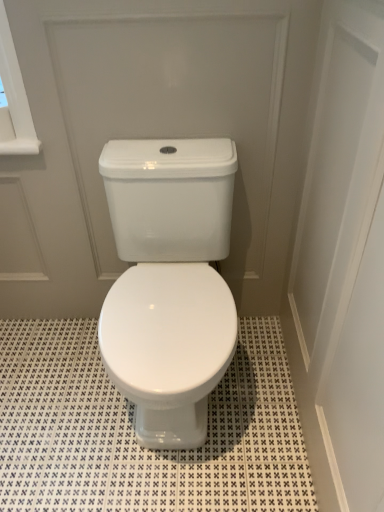
Question: Does white glossy tile at center appear on the right side of white glossy toilet at center, the 2th screen door when ordered from right to left?

Choices:
 (A) yes
 (B) no

Answer: (B)

Question: Is the position of white glossy tile at center less distant than that of white glossy toilet at center, acting as the 1th screen door starting from the left?

Choices:
 (A) yes
 (B) no

Answer: (B)

Question: Is white glossy tile at center aimed at white glossy toilet at center, acting as the 1th screen door starting from the left?

Choices:
 (A) no
 (B) yes

Answer: (A)

Question: Would you consider white glossy tile at center to be distant from white glossy toilet at center, the 2th screen door when ordered from right to left?

Choices:
 (A) yes
 (B) no

Answer: (B)

Question: Can you confirm if white glossy tile at center is thinner than white glossy toilet at center, acting as the 1th screen door starting from the left?

Choices:
 (A) yes
 (B) no

Answer: (B)

Question: Considering the relative positions of white glossy toilet at center, acting as the 1th screen door starting from the left, and white glossy door at upper center, the 2th screen door positioned from the left, in the image provided, is white glossy toilet at center, acting as the 1th screen door starting from the left, to the left or to the right of white glossy door at upper center, the 2th screen door positioned from the left,?

Choices:
 (A) left
 (B) right

Answer: (A)

Question: Considering the positions of point (196, 101) and point (372, 368), is point (196, 101) closer or farther from the camera than point (372, 368)?

Choices:
 (A) closer
 (B) farther

Answer: (B)

Question: From a real-world perspective, is white glossy toilet at center, the 2th screen door when ordered from right to left, above or below white glossy door at upper center, the 2th screen door positioned from the left?

Choices:
 (A) below
 (B) above

Answer: (A)

Question: In terms of size, does white glossy toilet at center, acting as the 1th screen door starting from the left, appear bigger or smaller than white glossy door at upper center, the 2th screen door positioned from the left?

Choices:
 (A) big
 (B) small

Answer: (B)

Question: From the image's perspective, is white glossy tile at center positioned above or below white glossy door at upper center, placed as the 1th screen door when sorted from right to left?

Choices:
 (A) below
 (B) above

Answer: (A)

Question: From their relative heights in the image, would you say white glossy tile at center is taller or shorter than white glossy door at upper center, placed as the 1th screen door when sorted from right to left?

Choices:
 (A) tall
 (B) short

Answer: (B)

Question: Considering the positions of white glossy tile at center and white glossy door at upper center, the 2th screen door positioned from the left, in the image, is white glossy tile at center wider or thinner than white glossy door at upper center, the 2th screen door positioned from the left,?

Choices:
 (A) wide
 (B) thin

Answer: (A)

Question: Which is correct: white glossy tile at center is inside white glossy door at upper center, the 2th screen door positioned from the left, or outside of it?

Choices:
 (A) inside
 (B) outside

Answer: (B)

Question: Is point (117, 478) closer or farther from the camera than point (77, 159)?

Choices:
 (A) closer
 (B) farther

Answer: (A)

Question: Is white glossy tile at center taller or shorter than white glossy toilet at center, the 2th screen door when ordered from right to left?

Choices:
 (A) tall
 (B) short

Answer: (B)